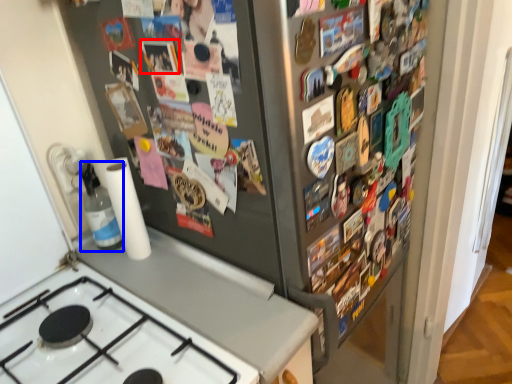
Question: Which of the following is the farthest to the observer, button (highlighted by a red box) or bottle (highlighted by a blue box)?

Choices:
 (A) button
 (B) bottle

Answer: (B)